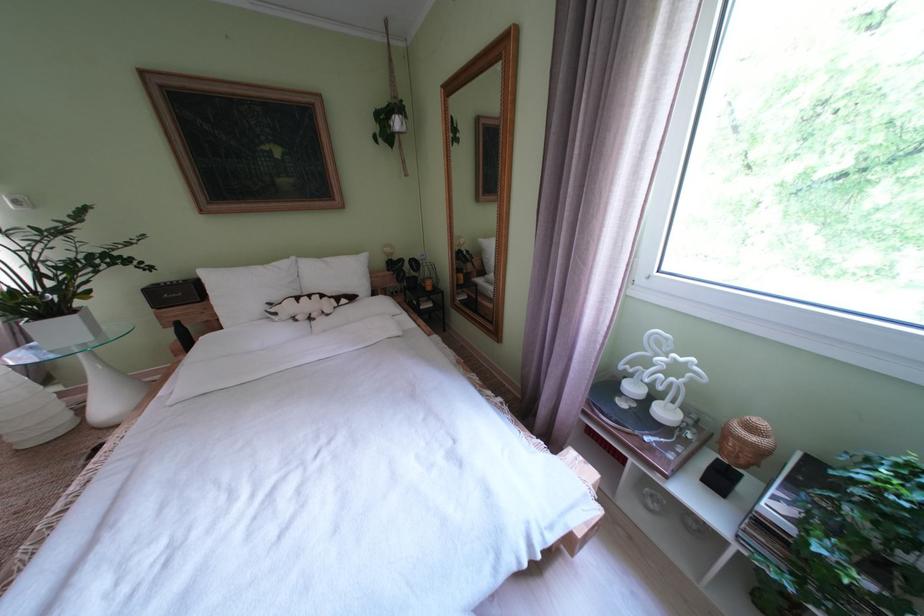
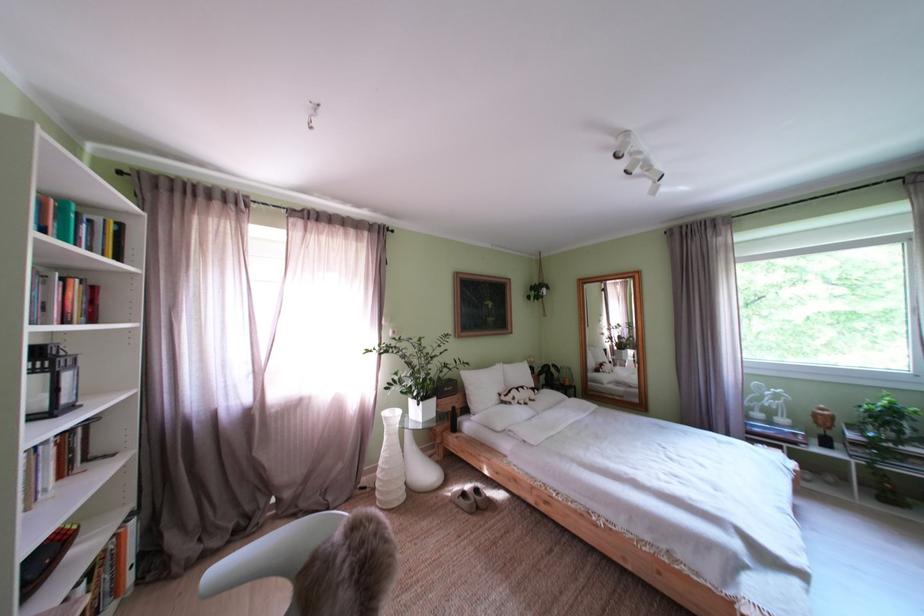
The point at (337, 317) is marked in the first image. Where is the corresponding point in the second image?

(543, 403)